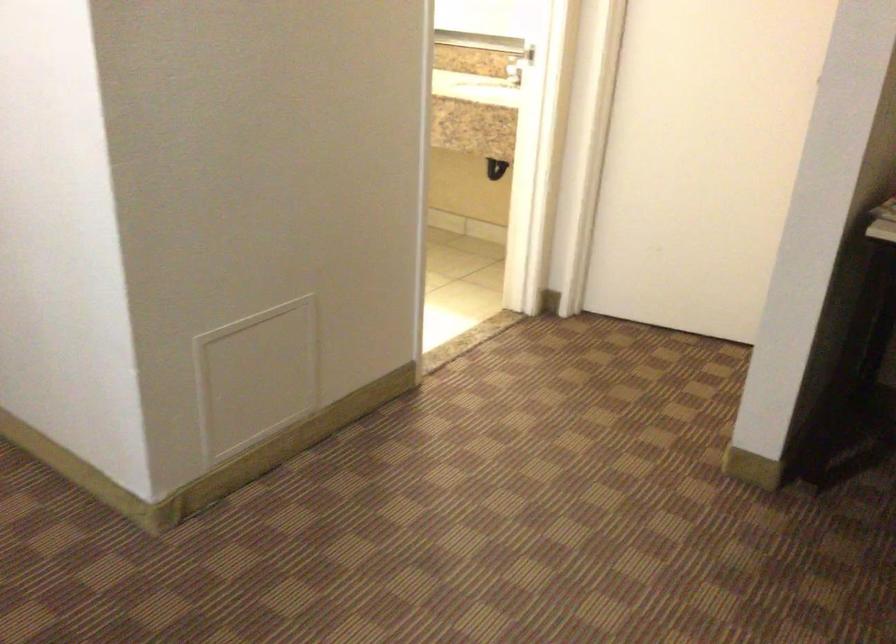
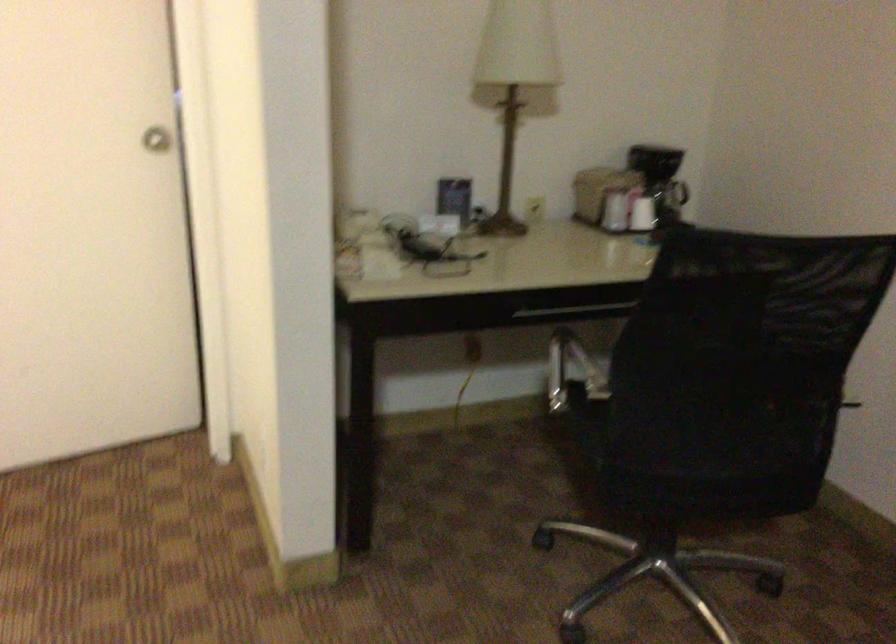
Find the pixel in the second image that matches pixel 780 67 in the first image.

(156, 138)